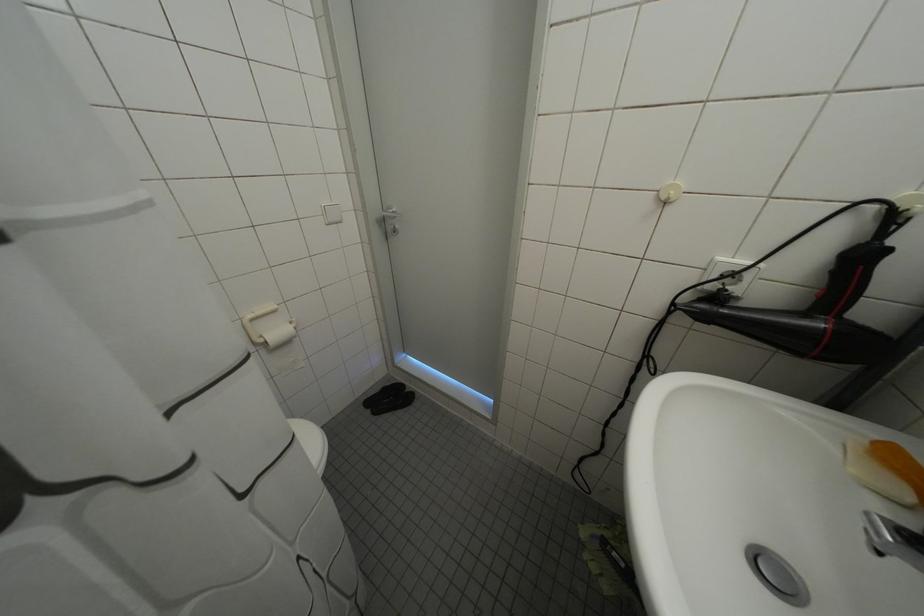
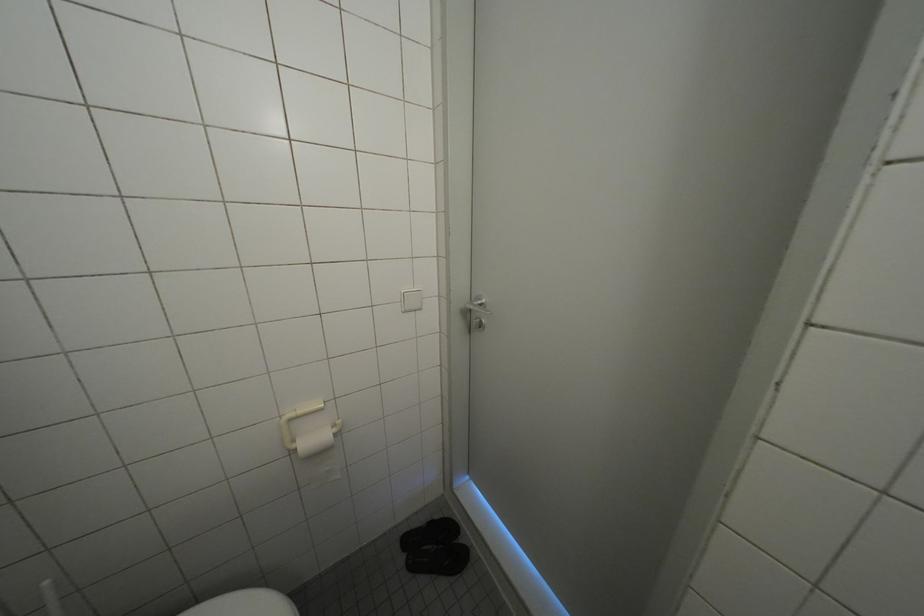
Question: What movement of the cameraman would produce the second image?

Choices:
 (A) Left
 (B) Right
 (C) Forward
 (D) Backward

Answer: (C)